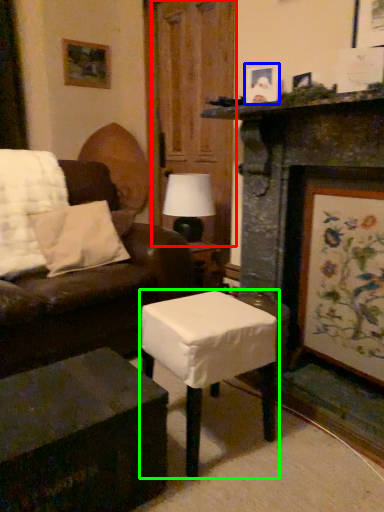
Question: Which object is positioned farthest from glass door (highlighted by a red box)? Select from picture frame (highlighted by a blue box) and table (highlighted by a green box).

Choices:
 (A) picture frame
 (B) table

Answer: (B)